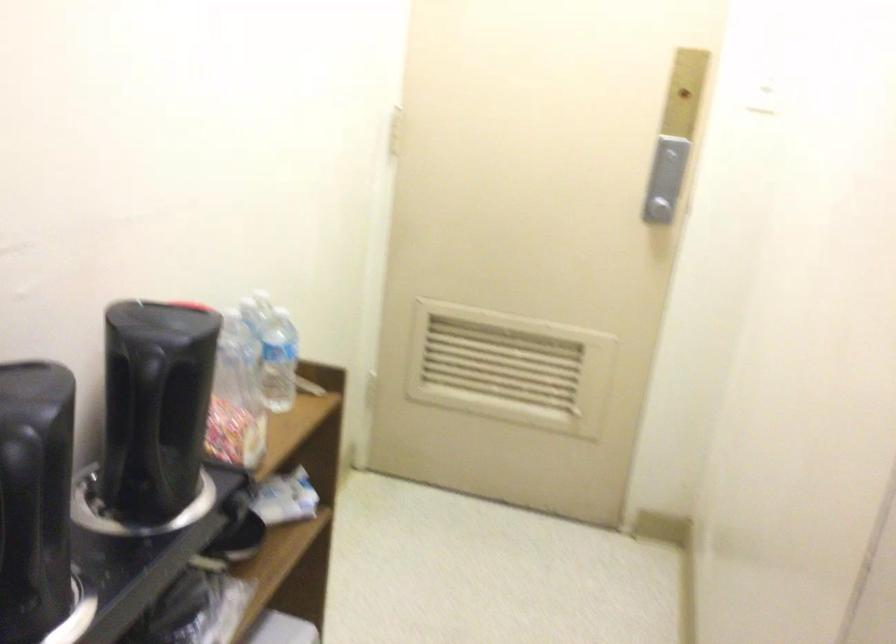
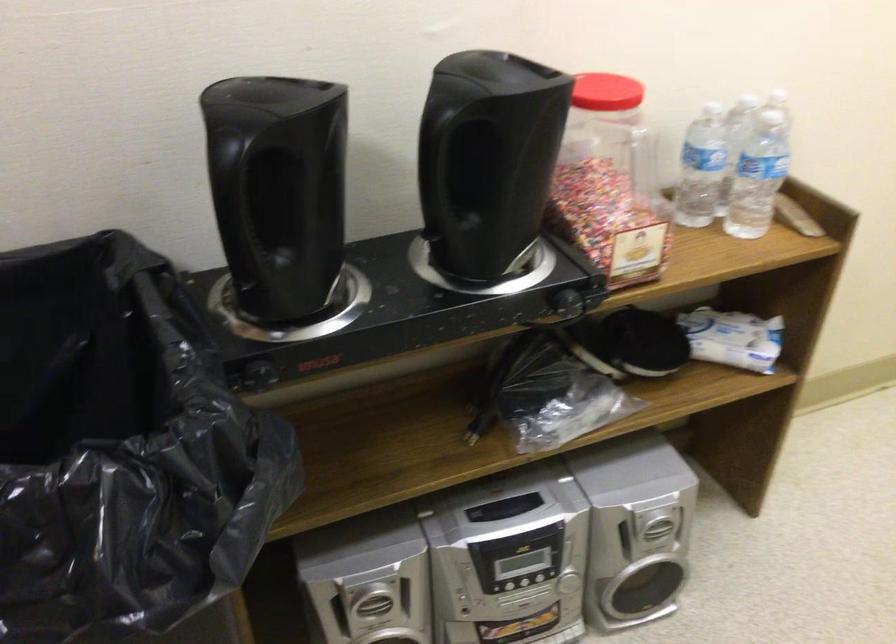
Locate, in the second image, the point that corresponds to point 286,502 in the first image.

(733, 337)